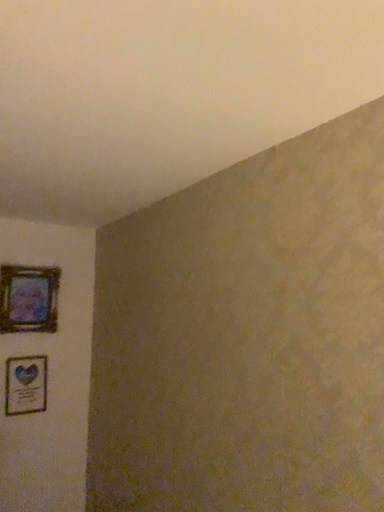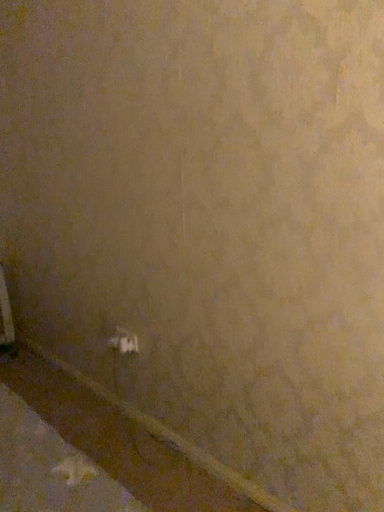
Question: How did the camera likely rotate when shooting the video?

Choices:
 (A) rotated upward
 (B) rotated downward

Answer: (B)